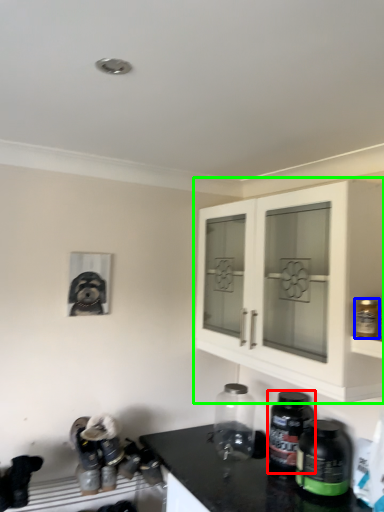
Question: Considering the real-world distances, which object is closest to bottle (highlighted by a red box)? bottle (highlighted by a blue box) or cabinetry (highlighted by a green box).

Choices:
 (A) bottle
 (B) cabinetry

Answer: (B)